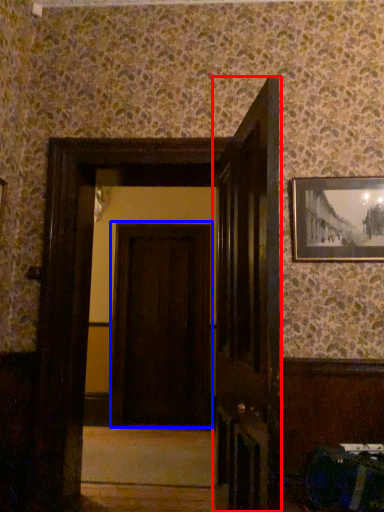
Question: Among these objects, which one is nearest to the camera, door (highlighted by a red box) or door (highlighted by a blue box)?

Choices:
 (A) door
 (B) door

Answer: (A)